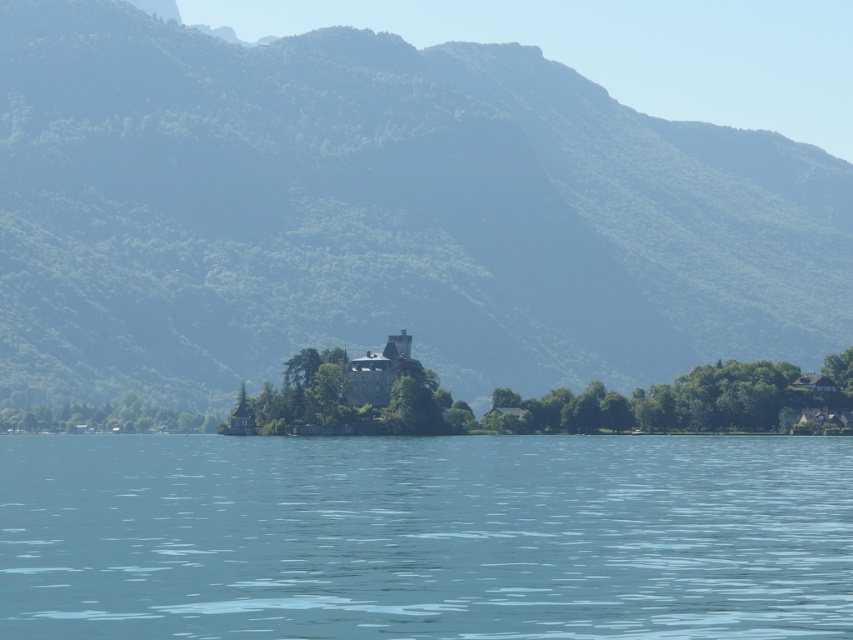
Question: Does transparent blue water at center appear under dark gray stone castle at center?

Choices:
 (A) yes
 (B) no

Answer: (A)

Question: Is green textured mountain at center below dark gray stone castle at center?

Choices:
 (A) no
 (B) yes

Answer: (A)

Question: Which object appears farthest from the camera in this image?

Choices:
 (A) green textured mountain at center
 (B) dark gray stone castle at center
 (C) transparent blue water at center

Answer: (A)

Question: Which point is farther to the camera?

Choices:
 (A) green textured mountain at center
 (B) dark gray stone castle at center

Answer: (A)

Question: Which point is closer to the camera?

Choices:
 (A) dark gray stone castle at center
 (B) transparent blue water at center

Answer: (B)

Question: Does transparent blue water at center appear over dark gray stone castle at center?

Choices:
 (A) yes
 (B) no

Answer: (B)